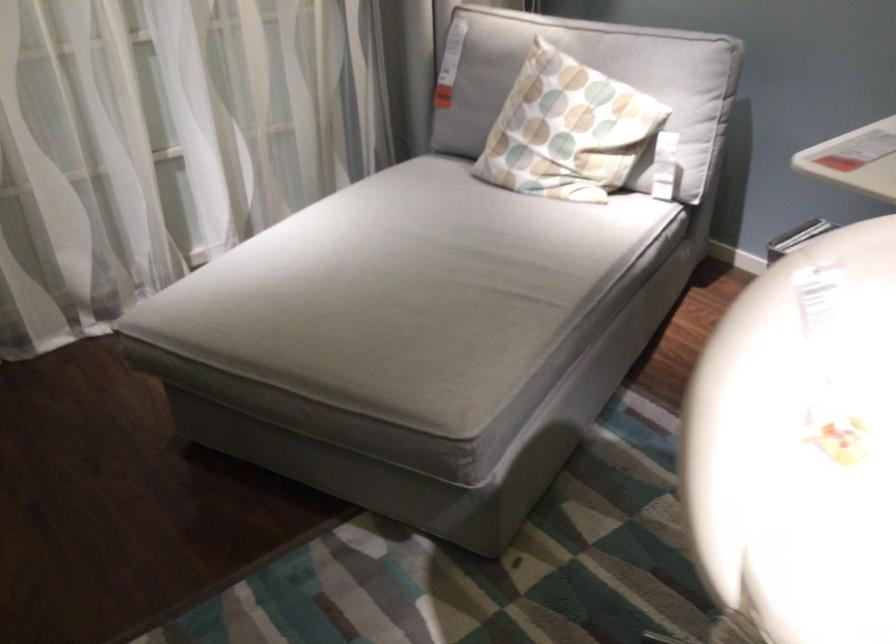
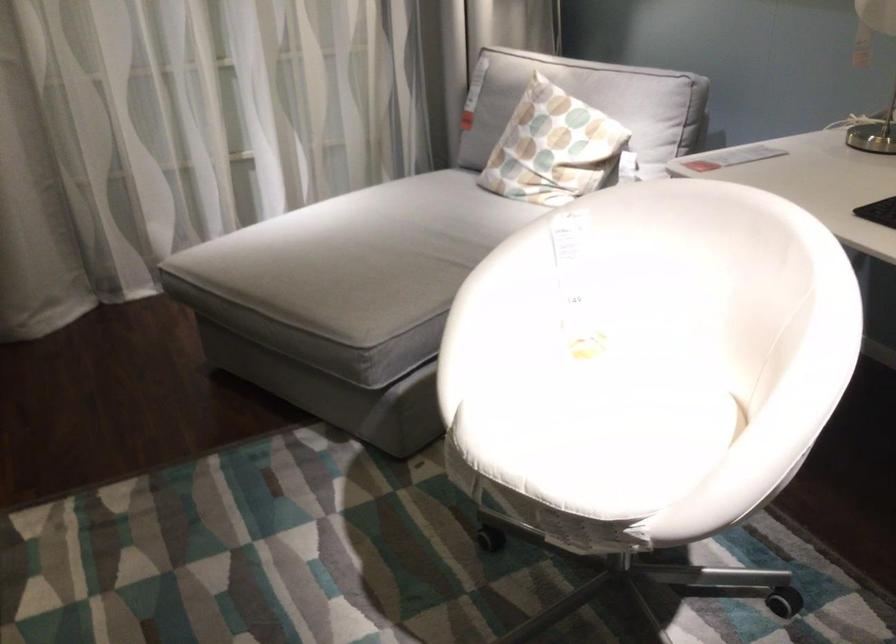
The point at [392,295] is marked in the first image. Where is the corresponding point in the second image?

(359, 256)